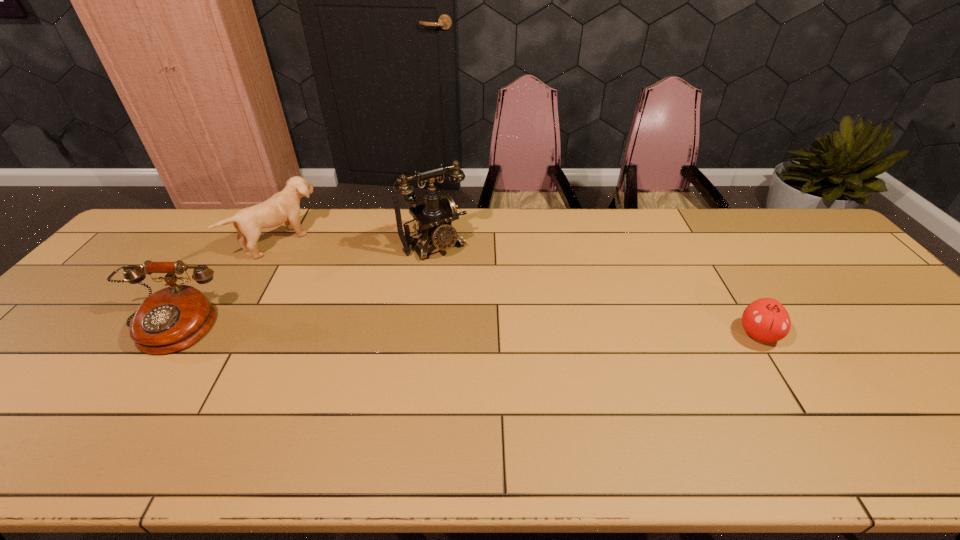
Where is `vacant area at the right edge of the desktop`? The width and height of the screenshot is (960, 540). vacant area at the right edge of the desktop is located at coordinates (863, 277).

This screenshot has width=960, height=540. I want to click on free spot at the far left corner of the desktop, so click(x=160, y=220).

What are the coordinates of `free space at the near left corner of the desktop` in the screenshot? It's located at (49, 395).

Where is `free space between the puppy and the apple`? free space between the puppy and the apple is located at coordinates (520, 287).

The width and height of the screenshot is (960, 540). Find the location of `empty space that is in between the puppy and the nearer telephone`. empty space that is in between the puppy and the nearer telephone is located at coordinates (225, 284).

Find the location of `free spot between the apple and the puppy`. free spot between the apple and the puppy is located at coordinates (520, 287).

Find the location of a particular element. unoccupied area between the farther telephone and the nearer telephone is located at coordinates (301, 286).

Find the location of a particular element. The width and height of the screenshot is (960, 540). free space between the apple and the right telephone is located at coordinates (596, 289).

Locate an element on the screen. The image size is (960, 540). free space between the shorter telephone and the puppy is located at coordinates point(225,284).

I want to click on unoccupied position between the rightmost object and the third object from left to right, so click(596, 289).